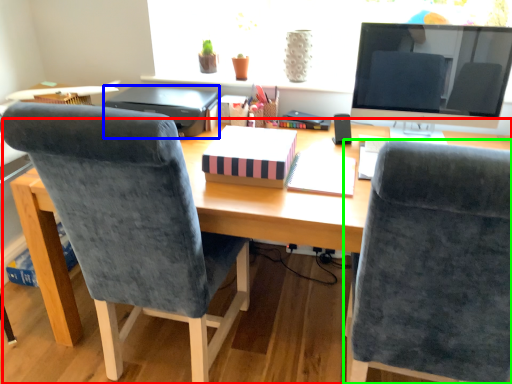
Question: Based on their relative distances, which object is farther from desk (highlighted by a red box)? Choose from printer (highlighted by a blue box) and chair (highlighted by a green box).

Choices:
 (A) printer
 (B) chair

Answer: (A)